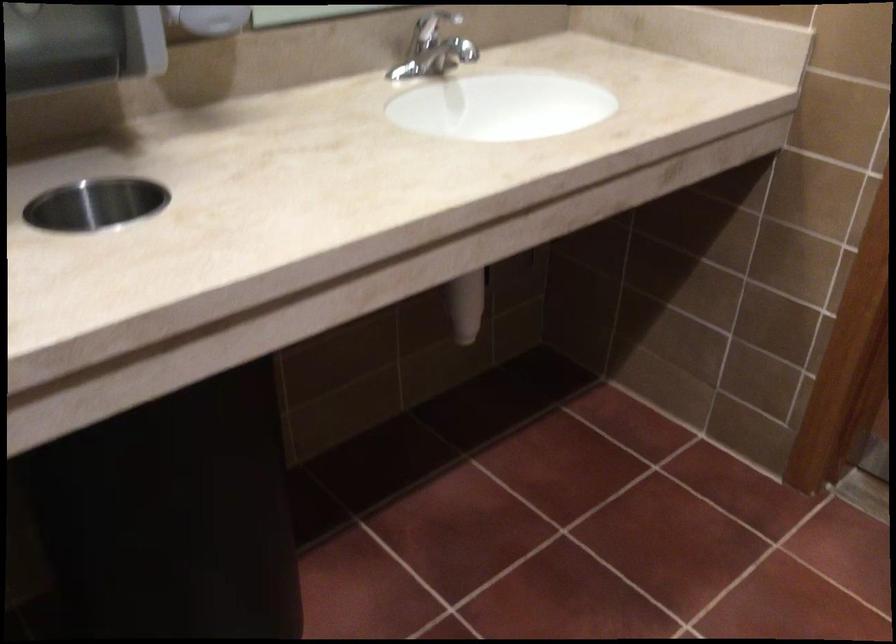
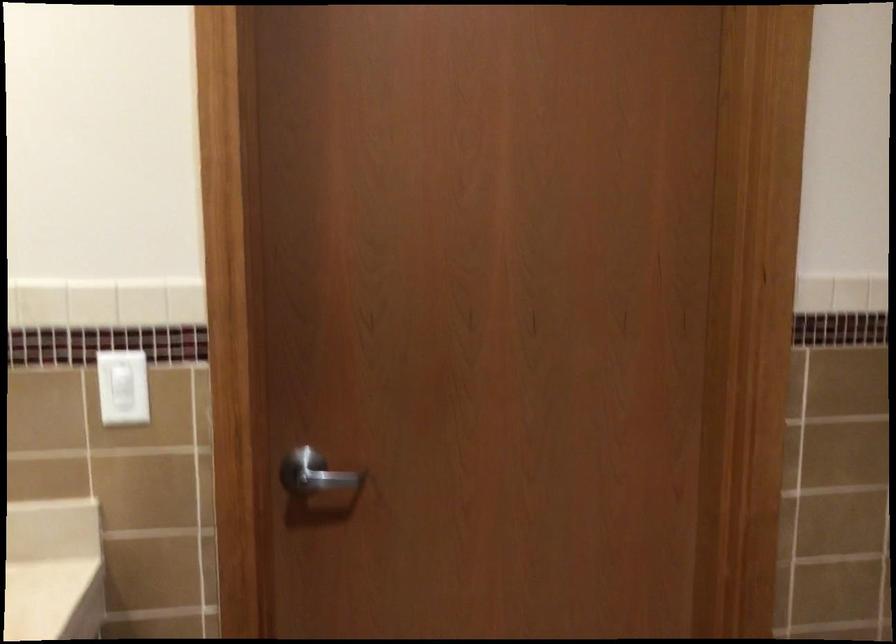
Question: The images are taken continuously from a first-person perspective. In which direction is your viewpoint rotating?

Choices:
 (A) Left
 (B) Right
 (C) Up
 (D) Down

Answer: (B)